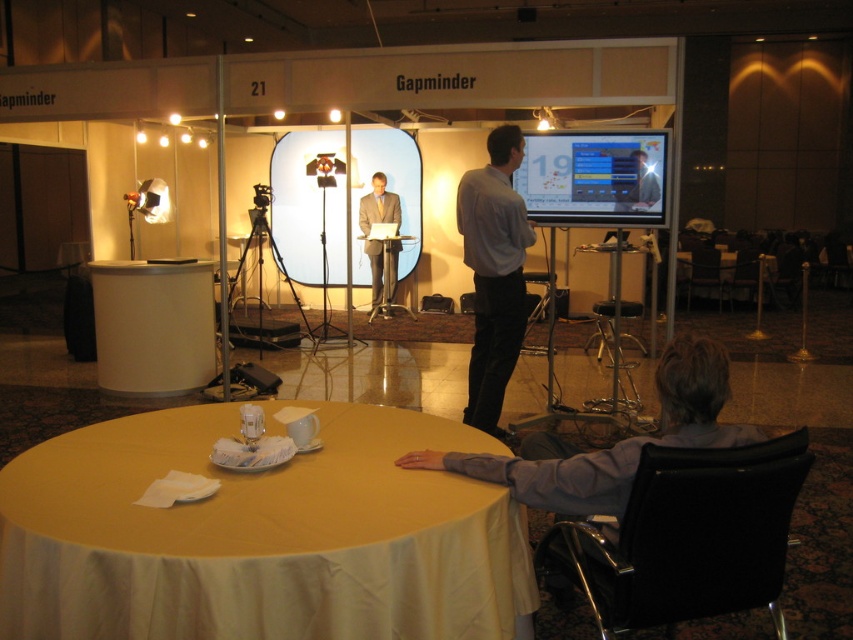
You are attending a conference and need to sit down. You see a black leather chair at lower right and a gray fabric chair at lower right. Which chair is taller?

The black leather chair at lower right is taller than the gray fabric chair at lower right.

You are sitting in the gray fabric chair at lower right and want to look at the matte white screen at center. Can you see the screen clearly without moving your head?

The gray fabric chair at lower right is in front of the matte white screen at center, so you can see the screen clearly without moving your head.